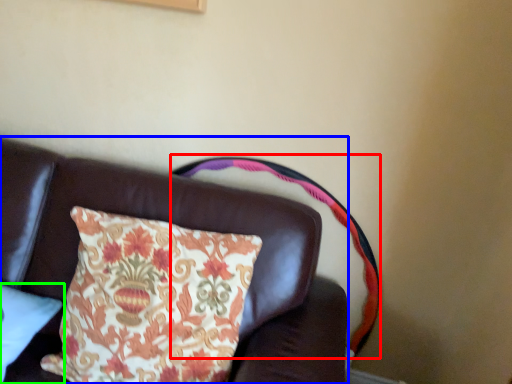
Question: Estimate the real-world distances between objects in this image. Which object is farther from swivel chair (highlighted by a red box), furniture (highlighted by a blue box) or pillow (highlighted by a green box)?

Choices:
 (A) furniture
 (B) pillow

Answer: (B)